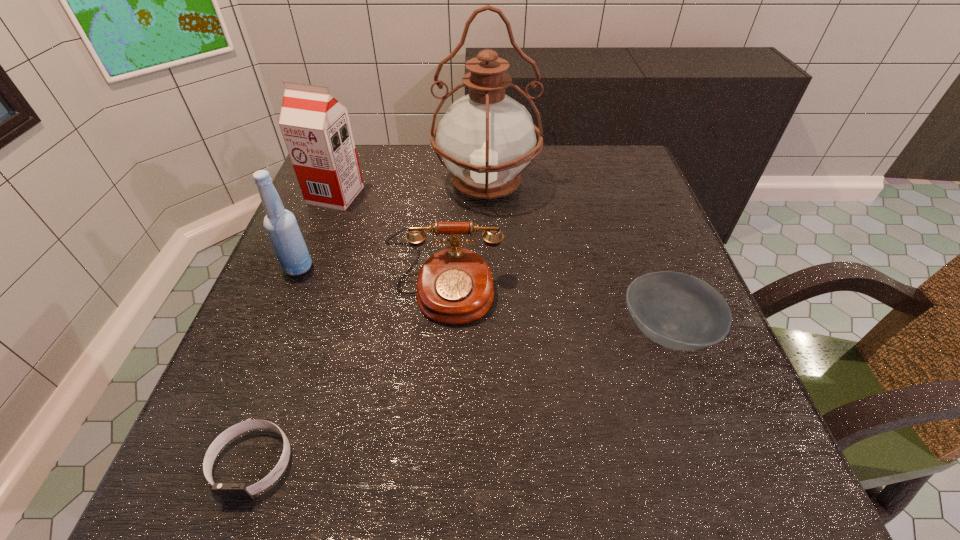
At what (x,y) coordinates should I click in order to perform the action: click on oil lamp. Please return your answer as a coordinate pair (x, y). The width and height of the screenshot is (960, 540). Looking at the image, I should click on (486, 138).

The width and height of the screenshot is (960, 540). What are the coordinates of `soya milk` in the screenshot? It's located at (316, 128).

You are a GUI agent. You are given a task and a screenshot of the screen. Output one action in this format:
    pyautogui.click(x=<x>, y=<y>)
    Task: Click on the fourth shortest object
    The width and height of the screenshot is (960, 540).
    Given the screenshot: What is the action you would take?
    pyautogui.click(x=281, y=226)

Where is `telephone`? This screenshot has width=960, height=540. telephone is located at coordinates (455, 285).

I want to click on the rightmost object, so click(681, 312).

At what (x,y) coordinates should I click in order to perform the action: click on the fifth tallest object. Please return your answer as a coordinate pair (x, y). Image resolution: width=960 pixels, height=540 pixels. Looking at the image, I should click on (681, 312).

Where is `the nearest object`? The image size is (960, 540). the nearest object is located at coordinates (227, 491).

You are a GUI agent. You are given a task and a screenshot of the screen. Output one action in this format:
    pyautogui.click(x=<x>, y=<y>)
    Task: Click on the shortest object
    
    Given the screenshot: What is the action you would take?
    pyautogui.click(x=227, y=491)

This screenshot has height=540, width=960. In order to click on free space located 0.340m on the front of the tallest object in this screenshot , I will do `click(489, 336)`.

The width and height of the screenshot is (960, 540). In order to click on vacant point located 0.120m on the front of the second tallest object in this screenshot , I will do [x=316, y=245].